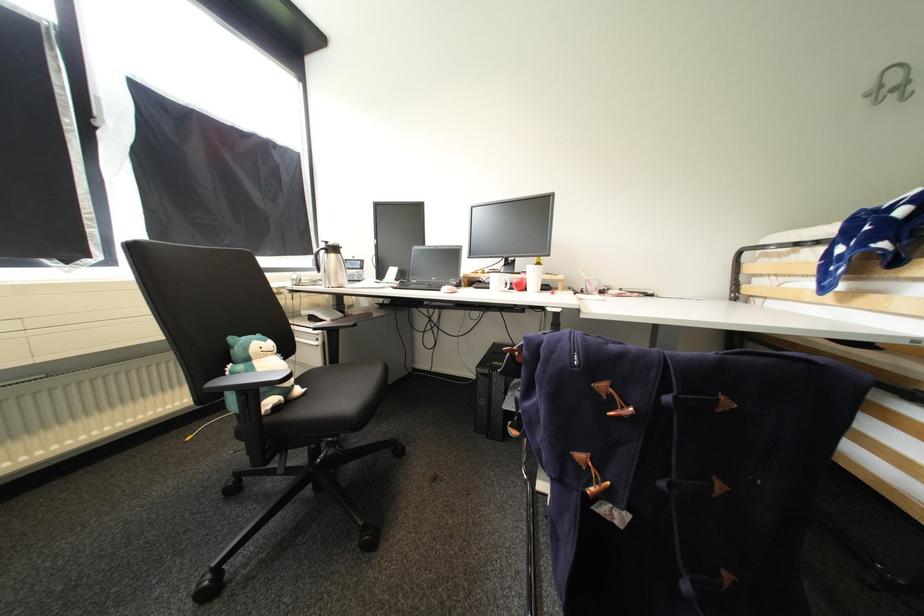
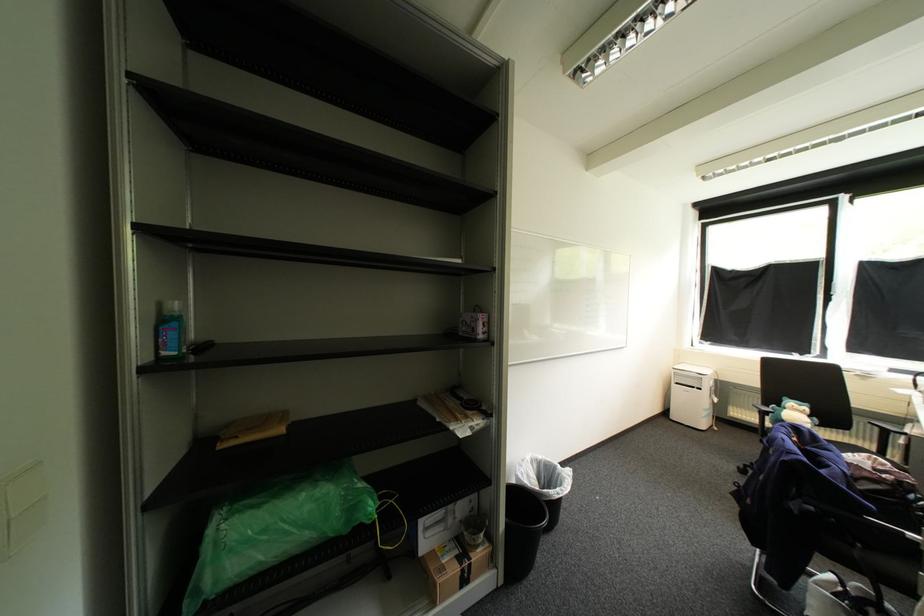
Question: I am providing you with two images of the same scene from different viewpoints. Which of the following objects are not visible in image2?

Choices:
 (A) plush toy
 (B) black chair sitting surface
 (C) small purple box
 (D) purple and black bag

Answer: (B)